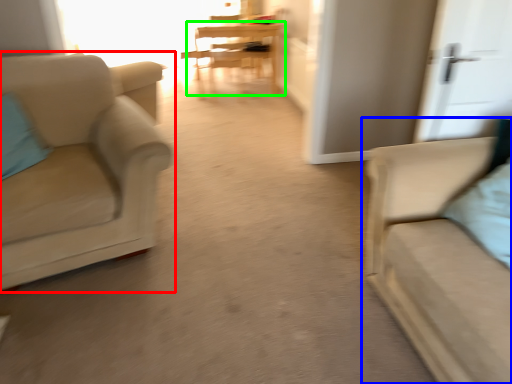
Question: Considering the real-world distances, which object is closest to chair (highlighted by a red box)? studio couch (highlighted by a blue box) or table (highlighted by a green box).

Choices:
 (A) studio couch
 (B) table

Answer: (A)